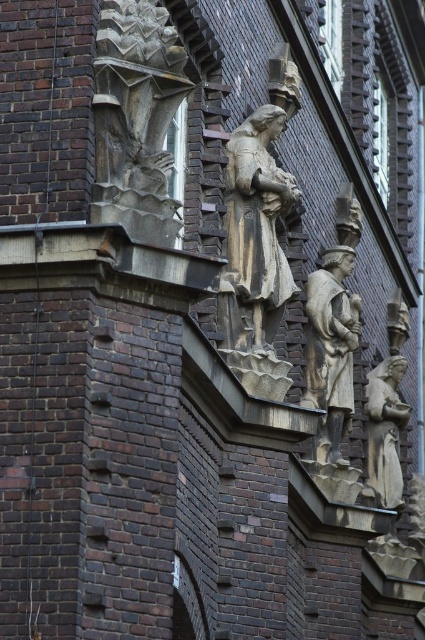
Who is more distant from viewer, [146,60] or [331,268]?

Point [331,268]

Is rustic stone carving at upper left further to the viewer compared to polished bronze statue at center?

No, rustic stone carving at upper left is in front of polished bronze statue at center.

Is point (127, 88) closer to camera compared to point (320, 376)?

That is True.

Find the location of a particular element. This screenshot has width=425, height=640. rustic stone carving at upper left is located at coordinates (136, 118).

Does rustic stone carving at upper left come in front of matte stone statue at lower right?

Yes, rustic stone carving at upper left is closer to the viewer.

Does point (142, 228) lie behind point (379, 372)?

No.

Is point (147, 150) positioned after point (399, 426)?

No.

Identify the location of rustic stone carving at upper left. Image resolution: width=425 pixels, height=640 pixels. (136, 118).

At what (x,y) coordinates should I click in order to perform the action: click on polished bronze statue at center. Please return your answer as a coordinate pair (x, y). The image size is (425, 640). Looking at the image, I should click on (331, 349).

Does polished bronze statue at center have a lesser width compared to matte stone statue at lower right?

In fact, polished bronze statue at center might be wider than matte stone statue at lower right.

At what (x,y) coordinates should I click in order to perform the action: click on polished bronze statue at center. Please return your answer as a coordinate pair (x, y). Looking at the image, I should click on (331, 349).

Locate an element on the screen. polished bronze statue at center is located at coordinates (331, 349).